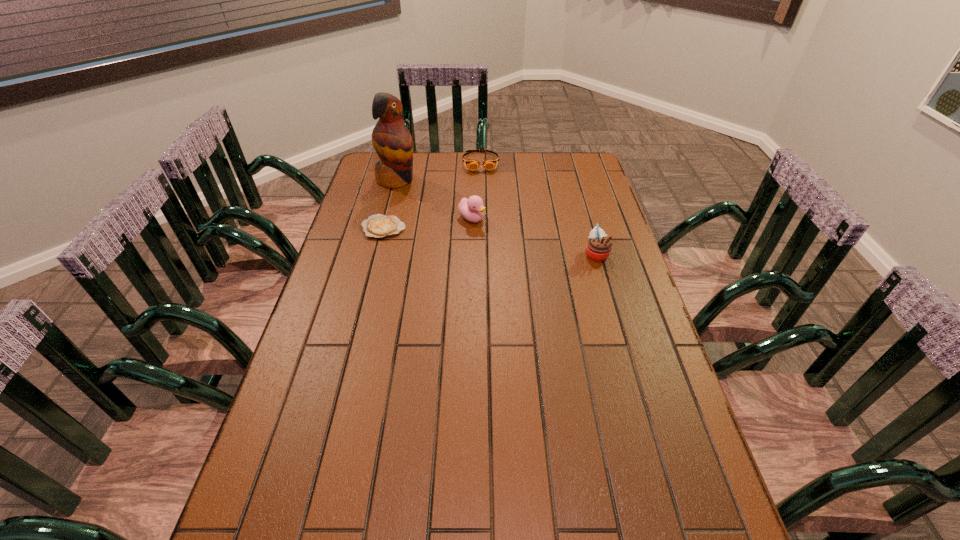
Find the location of a particular element. free point between the second shortest object and the nearest object is located at coordinates (539, 208).

Find the location of a particular element. The image size is (960, 540). free space between the parrot and the third shortest object is located at coordinates (434, 199).

The height and width of the screenshot is (540, 960). I want to click on vacant space that's between the third shortest object and the tallest object, so click(434, 199).

Where is `empty location between the third shortest object and the shortest object`? The image size is (960, 540). empty location between the third shortest object and the shortest object is located at coordinates (427, 224).

At what (x,y) coordinates should I click in order to perform the action: click on vacant point located between the goggles and the tallest object. Please return your answer as a coordinate pair (x, y). This screenshot has height=540, width=960. Looking at the image, I should click on (439, 171).

The image size is (960, 540). What are the coordinates of `free space between the duckling and the muffin` in the screenshot? It's located at (534, 236).

Identify the location of free spot between the duckling and the muffin. (534, 236).

Choose which object is the nearest neighbor to the goggles. Please provide its 2D coordinates. Your answer should be formatted as a tuple, i.e. [(x, y)], where the tuple contains the x and y coordinates of a point satisfying the conditions above.

[(392, 141)]

Select which object is the second closest to the parrot. Please provide its 2D coordinates. Your answer should be formatted as a tuple, i.e. [(x, y)], where the tuple contains the x and y coordinates of a point satisfying the conditions above.

[(489, 164)]

This screenshot has height=540, width=960. What are the coordinates of `vacant space that satisfies the following two spatial constraints: 1. on the front side of the nearest object; 2. on the front-facing side of the tallest object` in the screenshot? It's located at (377, 254).